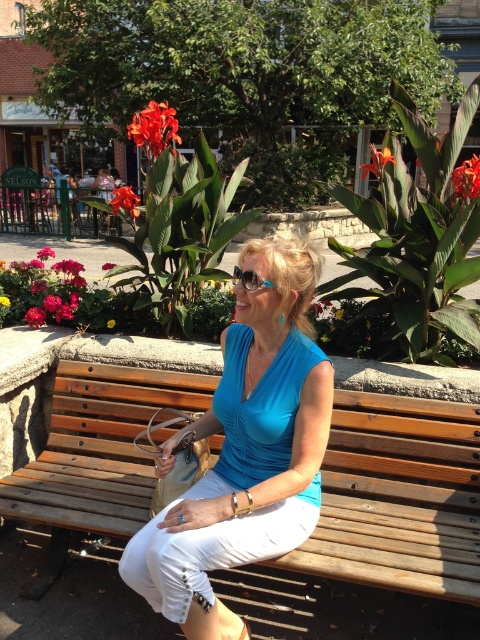
Does orange glossy flower at upper right appear on the left side of matte pink flower at lower left?

In fact, orange glossy flower at upper right is to the right of matte pink flower at lower left.

Does orange glossy flower at upper right appear on the right side of matte pink flower at lower left?

Yes, orange glossy flower at upper right is to the right of matte pink flower at lower left.

Find the location of a particular element. The image size is (480, 640). orange glossy flower at upper right is located at coordinates (466, 180).

Between smooth glossy flower at upper left and matte red flower at center, which one is positioned lower?

matte red flower at center is lower down.

Which is behind, point (132, 216) or point (46, 246)?

The point (46, 246) is more distant.

Where is `smooth glossy flower at upper left`? smooth glossy flower at upper left is located at coordinates (124, 200).

The image size is (480, 640). I want to click on smooth glossy flower at upper left, so click(124, 200).

Is wooden bench at center taller than orange glossy canna lily at center?

No, wooden bench at center is not taller than orange glossy canna lily at center.

Who is more forward, (456,513) or (163,145)?

Positioned in front is point (456,513).

Identify the location of wooden bench at center. (398, 497).